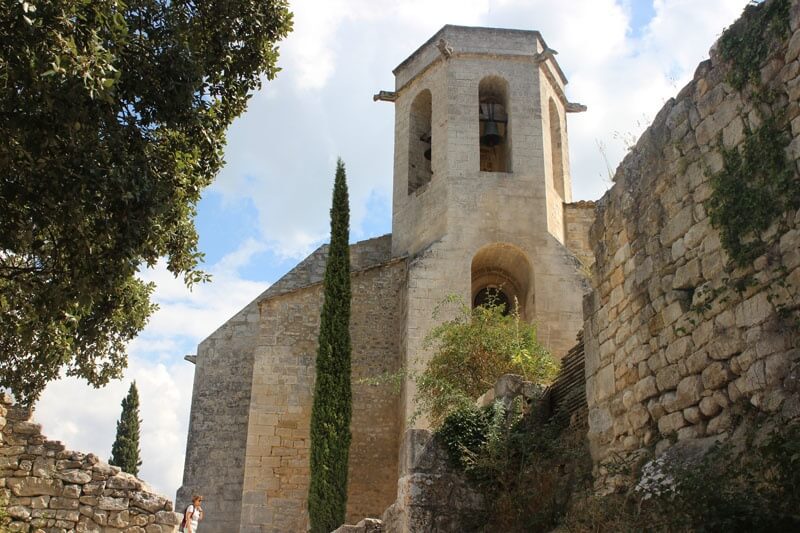
The image size is (800, 533). Identify the location of brick wall. (677, 252).